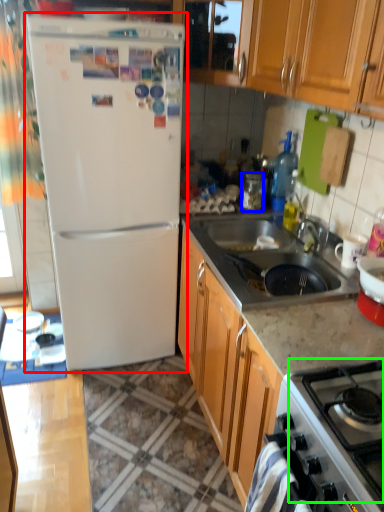
Question: Which object is the farthest from refrigerator (highlighted by a red box)? Choose among these: appliance (highlighted by a blue box) or gas stove (highlighted by a green box).

Choices:
 (A) appliance
 (B) gas stove

Answer: (B)